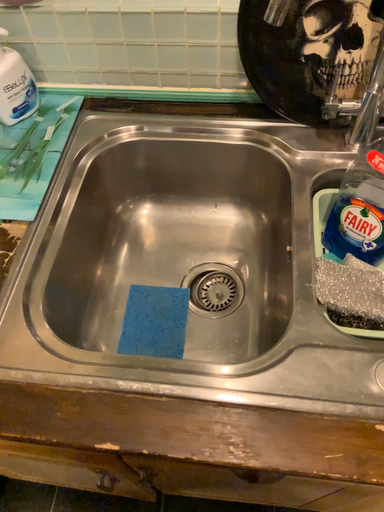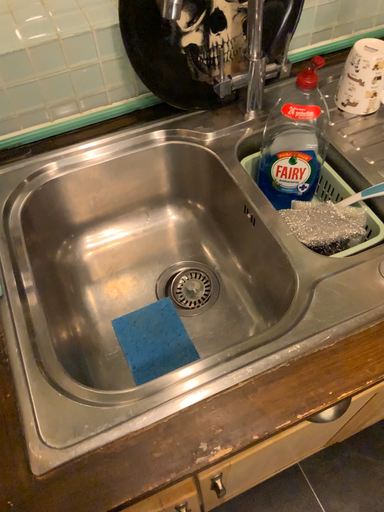
Question: Which way did the camera rotate in the video?

Choices:
 (A) rotated upward
 (B) rotated downward

Answer: (A)